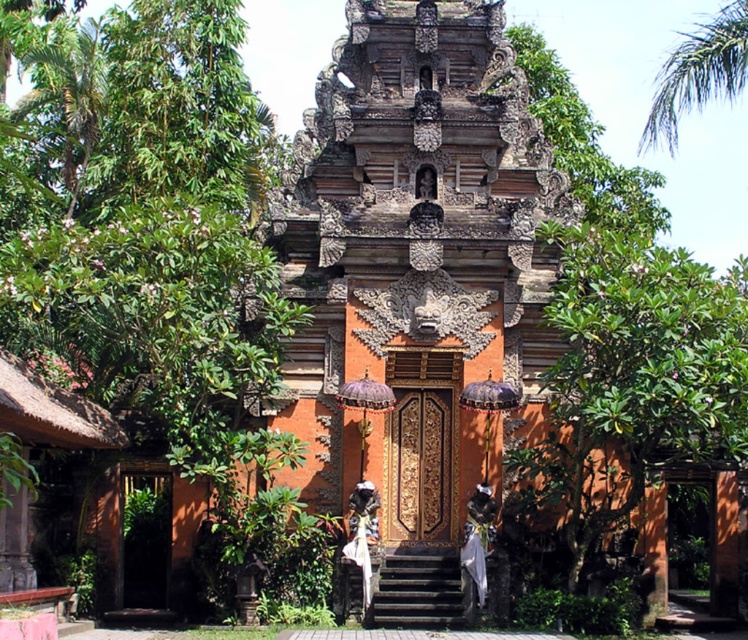
You are standing at the entrance of the traditional Balinese temple and notice a point marked at coordinates (634,378). Based on the scene description, where exactly is this point located?

The point at (634,378) is located on the green leafy tree at center.

You are a visitor at the temple and want to place a small offering on the altar. The offering must be placed between the green leafy tree at center and the white cloth at center. Considering their widths, which object should you position closer to the altar to ensure the offering fits properly?

The white cloth at center is narrower than the green leafy tree at center, so you should position the white cloth at center closer to the altar to accommodate the offering between them.